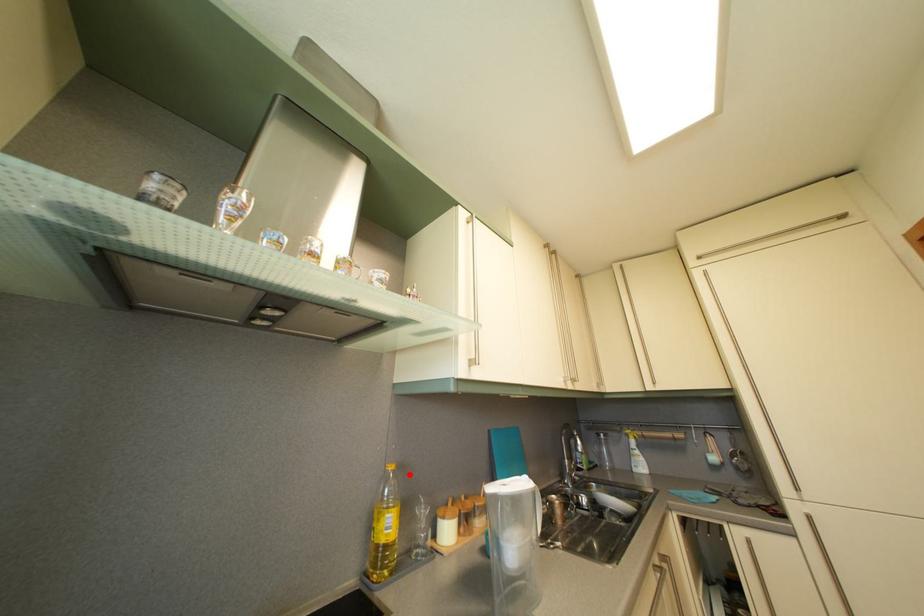
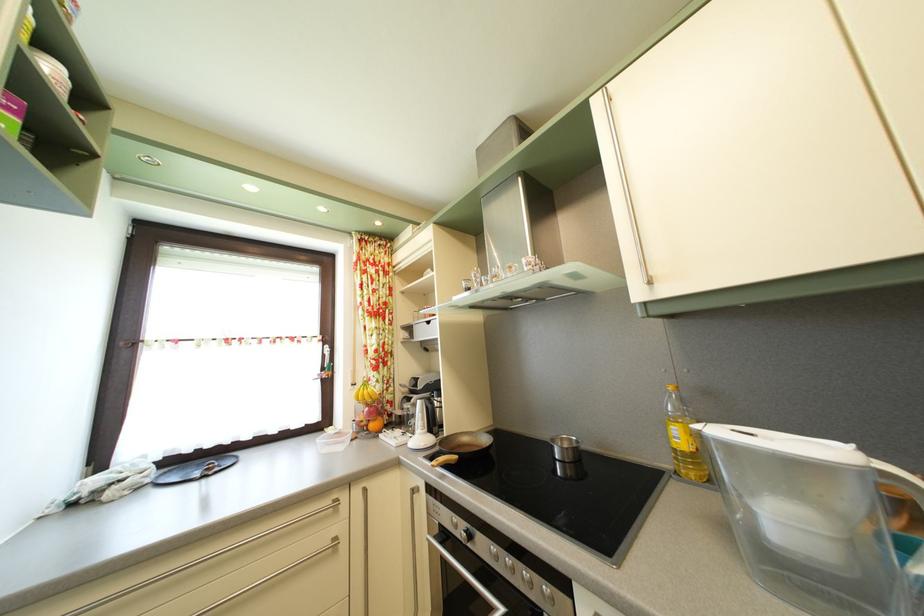
Where in the second image is the point corresponding to the highlighted location from the first image?

(715, 400)